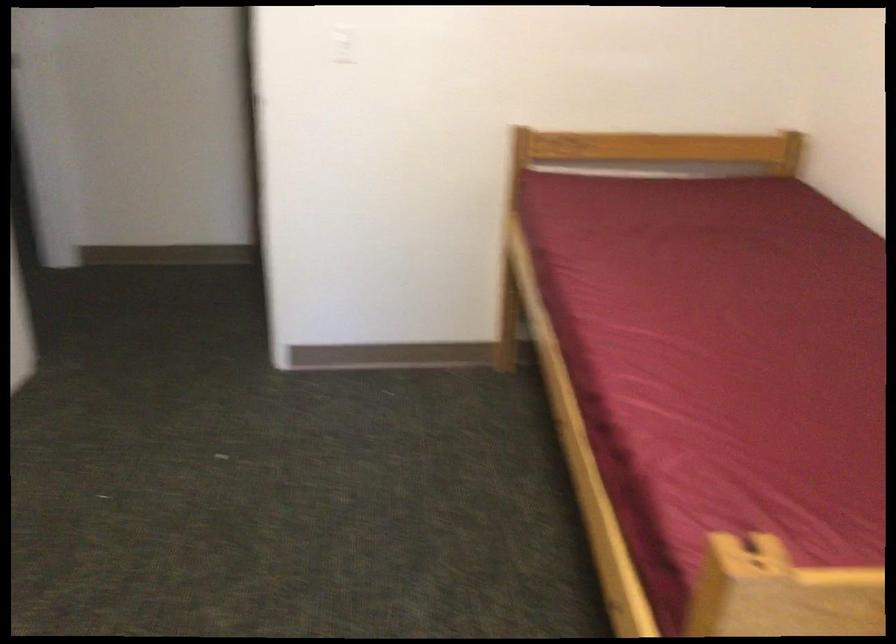
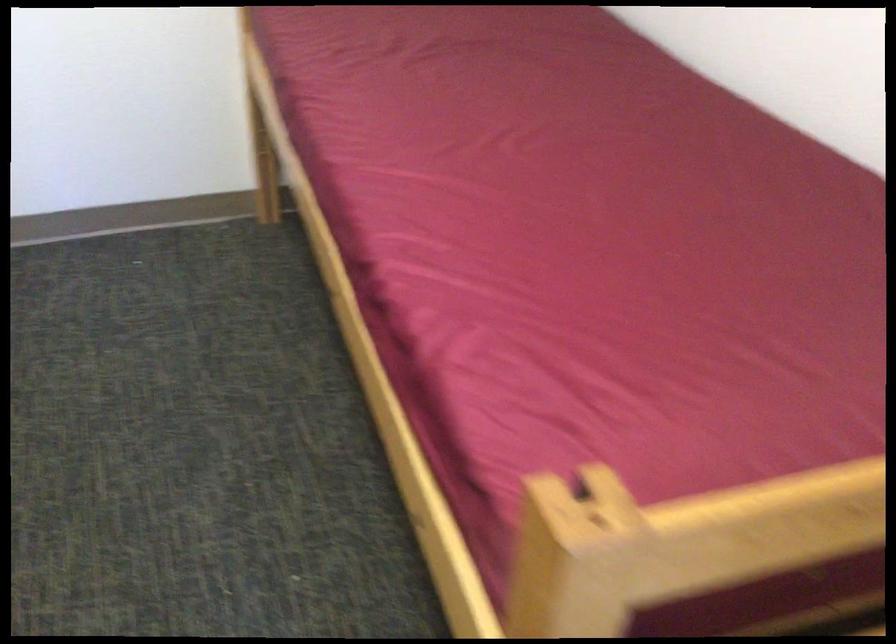
Question: In a continuous first-person perspective shot, in which direction is the camera moving?

Choices:
 (A) Left
 (B) Right
 (C) Forward
 (D) Backward

Answer: (C)